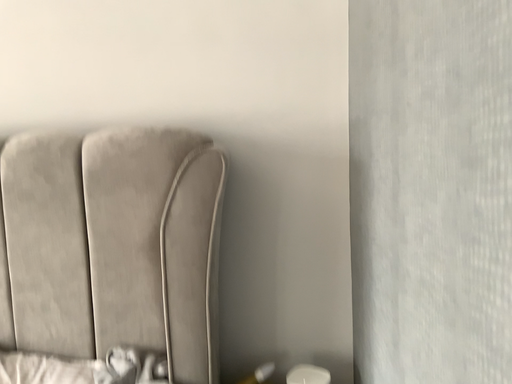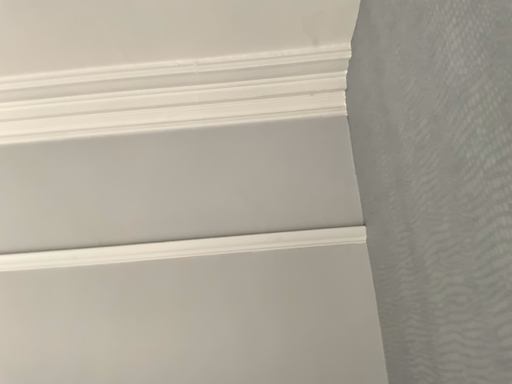
Question: Which way did the camera rotate in the video?

Choices:
 (A) rotated upward
 (B) rotated downward

Answer: (A)